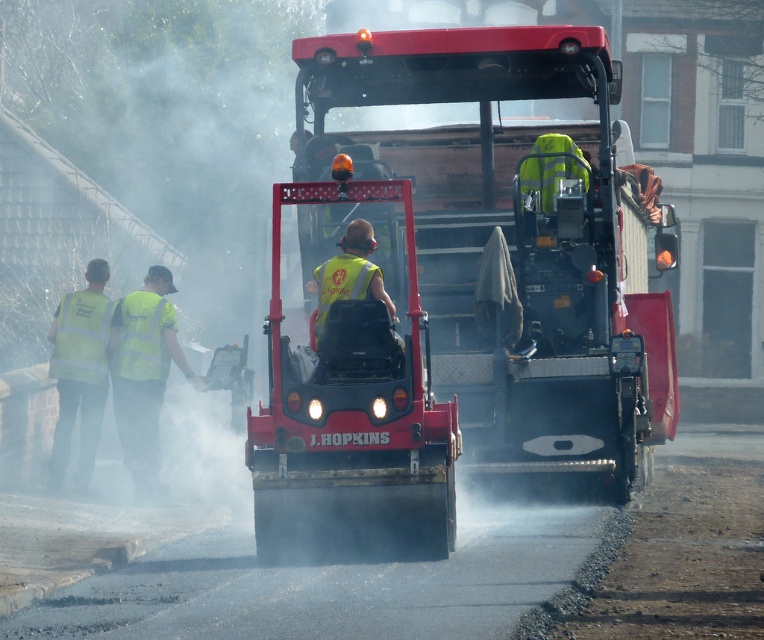
Question: Estimate the real-world distances between objects in this image. Which object is closer to the high visibility yellow safety vest at left?

Choices:
 (A) yellow reflective vest at left
 (B) yellow reflective vest at center
 (C) bright yellow reflective safety vest at center
 (D) matte red asphalt compactor at center

Answer: (C)

Question: Considering the real-world distances, which object is closest to the yellow reflective vest at left?

Choices:
 (A) high visibility vest at left
 (B) high visibility yellow safety vest at left

Answer: (A)

Question: Does yellow reflective vest at left lie in front of bright yellow reflective safety vest at center?

Choices:
 (A) no
 (B) yes

Answer: (B)

Question: Can you confirm if yellow reflective vest at left is positioned to the left of high visibility yellow safety vest at left?

Choices:
 (A) no
 (B) yes

Answer: (A)

Question: Does yellow reflective vest at center appear on the right side of bright yellow reflective safety vest at center?

Choices:
 (A) yes
 (B) no

Answer: (A)

Question: Which object is the farthest from the matte red asphalt compactor at center?

Choices:
 (A) bright yellow reflective safety vest at center
 (B) yellow reflective vest at left
 (C) high visibility yellow safety vest at left

Answer: (C)